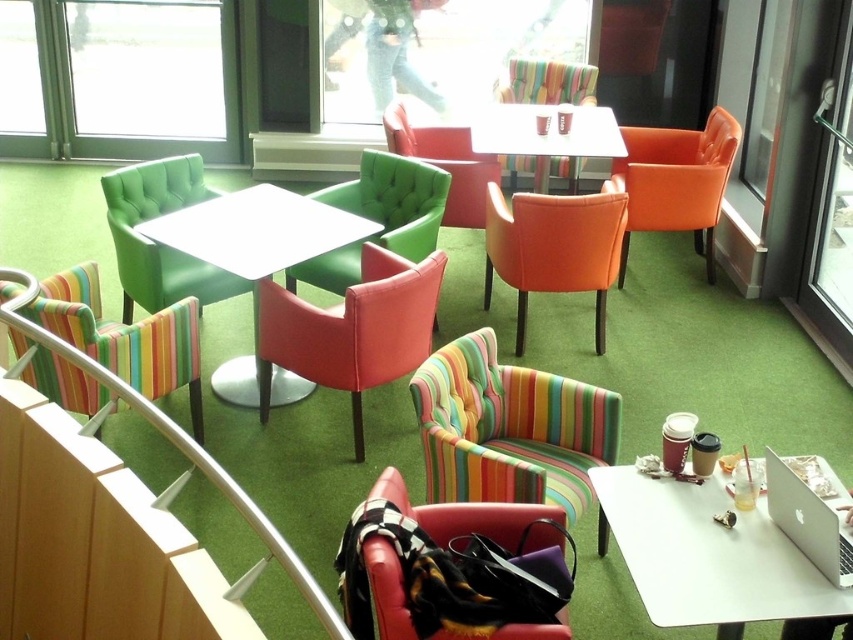
You are standing in the cozy indoor seating area and want to sit down. Where exactly is the matte black armchair at lower center located in the room?

The matte black armchair at lower center is located at point 0.803 in the x coordinate and 0.544 in the y coordinate.

You are trying to decide between sitting on the multicolored striped armchair at lower left and the matte orange armchair at center. Which one is shorter?

The multicolored striped armchair at lower left is shorter than the matte orange armchair at center.

You are a customer looking for a seat in the cozy indoor seating area. You see the multicolored striped armchair at lower left and the matte orange armchair at center. Which chair is closer to you?

Answer: The multicolored striped armchair at lower left is closer to you because it is in front of the matte orange armchair at center.